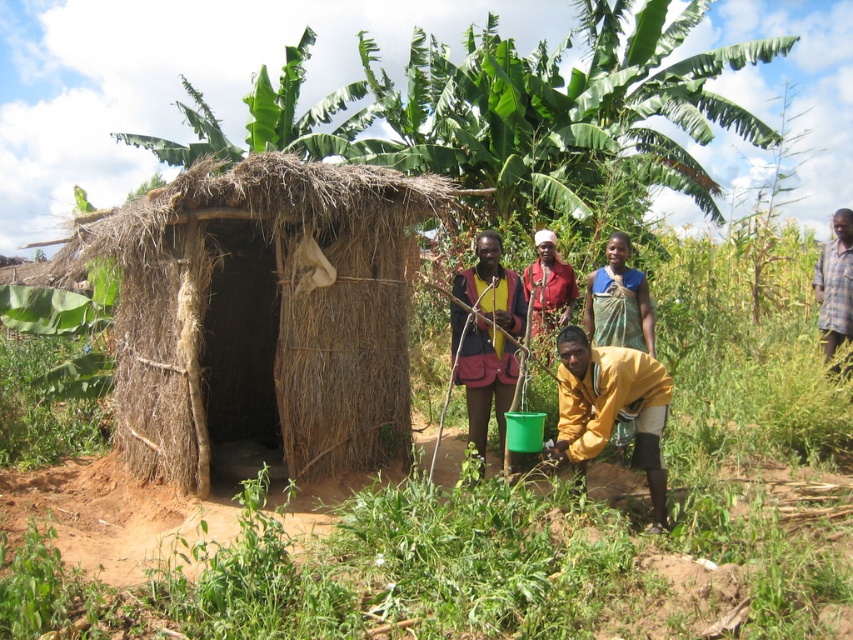
Is brown thatch hut at center taller than yellow matte shirt at lower center?

Yes, brown thatch hut at center is taller than yellow matte shirt at lower center.

Which is behind, point (436, 208) or point (554, 445)?

Positioned behind is point (436, 208).

Image resolution: width=853 pixels, height=640 pixels. What are the coordinates of `brown thatch hut at center` in the screenshot? It's located at (263, 314).

Can you confirm if yellow fabric shirt at center is wider than red fabric headscarf at center?

Incorrect, yellow fabric shirt at center's width does not surpass red fabric headscarf at center's.

Does yellow fabric shirt at center appear on the left side of red fabric headscarf at center?

Indeed, yellow fabric shirt at center is positioned on the left side of red fabric headscarf at center.

Measure the distance between point (x=500, y=387) and camera.

Point (x=500, y=387) and camera are 6.20 meters apart from each other.

Locate an element on the screen. The height and width of the screenshot is (640, 853). yellow fabric shirt at center is located at coordinates (486, 337).

Is green leafy banana tree at upper center bigger than yellow matte shirt at lower center?

Indeed, green leafy banana tree at upper center has a larger size compared to yellow matte shirt at lower center.

Does green leafy banana tree at upper center have a greater width compared to yellow matte shirt at lower center?

Yes.

This screenshot has width=853, height=640. Describe the element at coordinates (511, 113) in the screenshot. I see `green leafy banana tree at upper center` at that location.

At what (x,y) coordinates should I click in order to perform the action: click on green leafy banana tree at upper center. Please return your answer as a coordinate pair (x, y). Looking at the image, I should click on (511, 113).